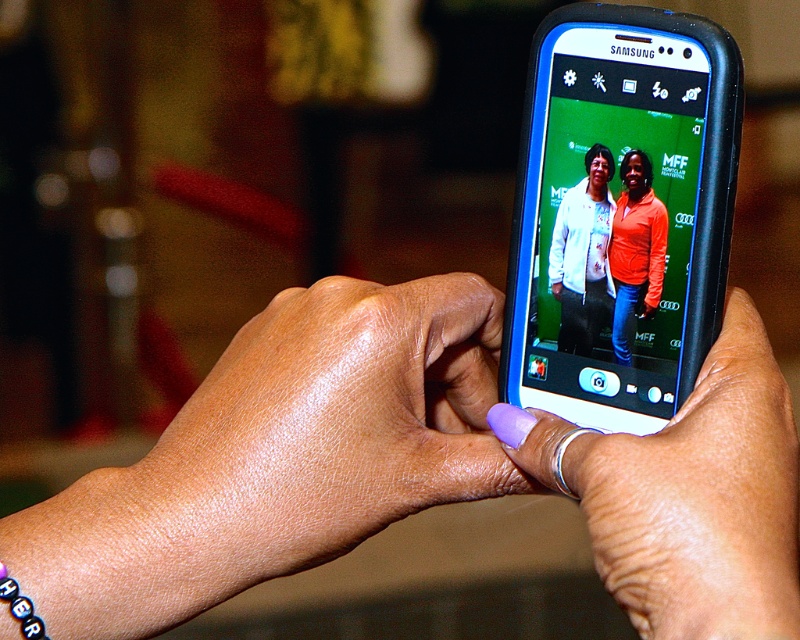
You are a photographer adjusting lighting for a closeup shot of hands holding a Samsung smartphone. You notice the purple nail polish at center and the purple acrylic nail at center. Which object is closer to the camera lens?

The purple nail polish at center is 8.64 centimeters away from the purple acrylic nail at center. Since the nail polish is closer to the lens, it would appear larger in the photo compared to the acrylic nail.

You are a photographer checking the composition of the photo displayed on the Samsung smartphone. You notice the purple acrylic nail at center and the white matte jacket at center in the frame. Which object appears taller in the photo?

The purple acrylic nail at center appears taller than the white matte jacket at center in the photo.

You are a photographer who wants to take a closeup shot of the purple acrylic nail at center. The camera is 12.36 inches away from the nail. Is this distance sufficient to capture the nail clearly?

The camera is 12.36 inches away from the purple acrylic nail at center, so this distance is sufficient to capture the nail clearly.